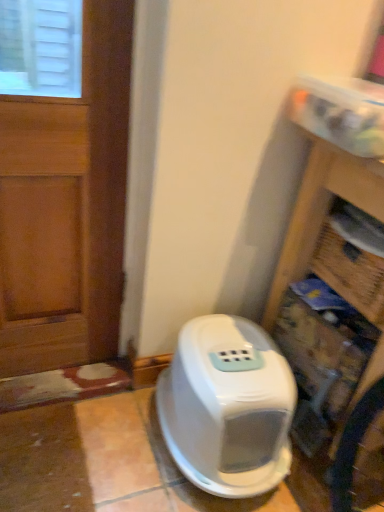
Question: Does wooden bookshelf at right have a greater height compared to white plastic litter box at lower center?

Choices:
 (A) no
 (B) yes

Answer: (B)

Question: Could you tell me if wooden bookshelf at right is facing white plastic litter box at lower center?

Choices:
 (A) no
 (B) yes

Answer: (B)

Question: From the image's perspective, would you say wooden bookshelf at right is positioned over white plastic litter box at lower center?

Choices:
 (A) no
 (B) yes

Answer: (B)

Question: From a real-world perspective, is wooden bookshelf at right on white plastic litter box at lower center?

Choices:
 (A) yes
 (B) no

Answer: (A)

Question: Does wooden bookshelf at right come in front of white plastic litter box at lower center?

Choices:
 (A) yes
 (B) no

Answer: (A)

Question: Visually, is wooden bookshelf at right positioned to the left or to the right of white plastic litter box at lower center?

Choices:
 (A) right
 (B) left

Answer: (A)

Question: Is wooden bookshelf at right wider or thinner than white plastic litter box at lower center?

Choices:
 (A) thin
 (B) wide

Answer: (B)

Question: Would you say wooden bookshelf at right is inside or outside white plastic litter box at lower center?

Choices:
 (A) outside
 (B) inside

Answer: (A)

Question: From a real-world perspective, is wooden bookshelf at right physically located above or below white plastic litter box at lower center?

Choices:
 (A) above
 (B) below

Answer: (A)

Question: In the image, is white plastic litter box at lower center on the left side or the right side of wooden door at left?

Choices:
 (A) right
 (B) left

Answer: (A)

Question: Is white plastic litter box at lower center wider or thinner than wooden door at left?

Choices:
 (A) thin
 (B) wide

Answer: (B)

Question: Is white plastic litter box at lower center inside or outside of wooden door at left?

Choices:
 (A) outside
 (B) inside

Answer: (A)

Question: Does point (x=281, y=467) appear closer or farther from the camera than point (x=51, y=274)?

Choices:
 (A) closer
 (B) farther

Answer: (A)

Question: From a real-world perspective, is wooden door at left physically located above or below white plastic litter box at lower center?

Choices:
 (A) below
 (B) above

Answer: (B)

Question: Is wooden door at left situated inside white plastic litter box at lower center or outside?

Choices:
 (A) outside
 (B) inside

Answer: (A)